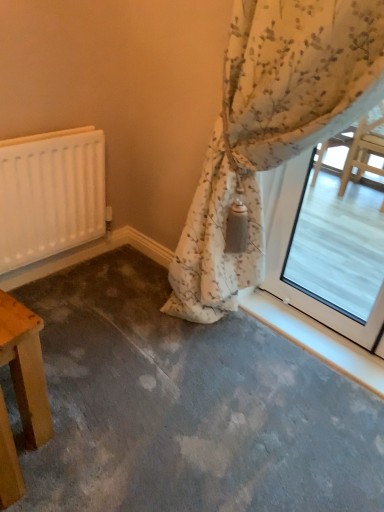
Question: Is floral fabric curtain at upper right wider or thinner than white matte radiator at left?

Choices:
 (A) thin
 (B) wide

Answer: (B)

Question: In terms of height, does floral fabric curtain at upper right look taller or shorter compared to white matte radiator at left?

Choices:
 (A) tall
 (B) short

Answer: (A)

Question: Which of these objects is positioned closest to the floral fabric curtain at upper right?

Choices:
 (A) wooden table at lower left
 (B) white matte radiator at left

Answer: (B)

Question: Which is nearer to the floral fabric curtain at upper right?

Choices:
 (A) white matte radiator at left
 (B) wooden table at lower left

Answer: (A)